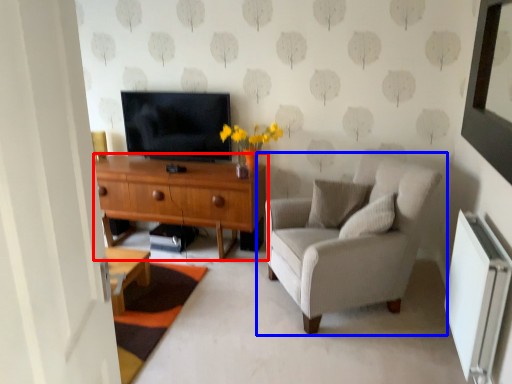
Question: Which object is closer to the camera taking this photo, desk (highlighted by a red box) or chair (highlighted by a blue box)?

Choices:
 (A) desk
 (B) chair

Answer: (B)